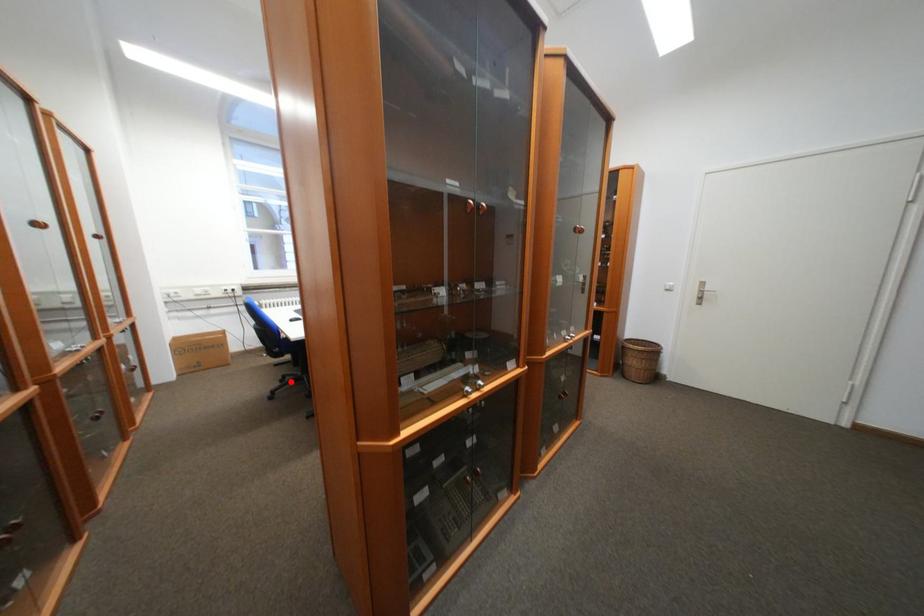
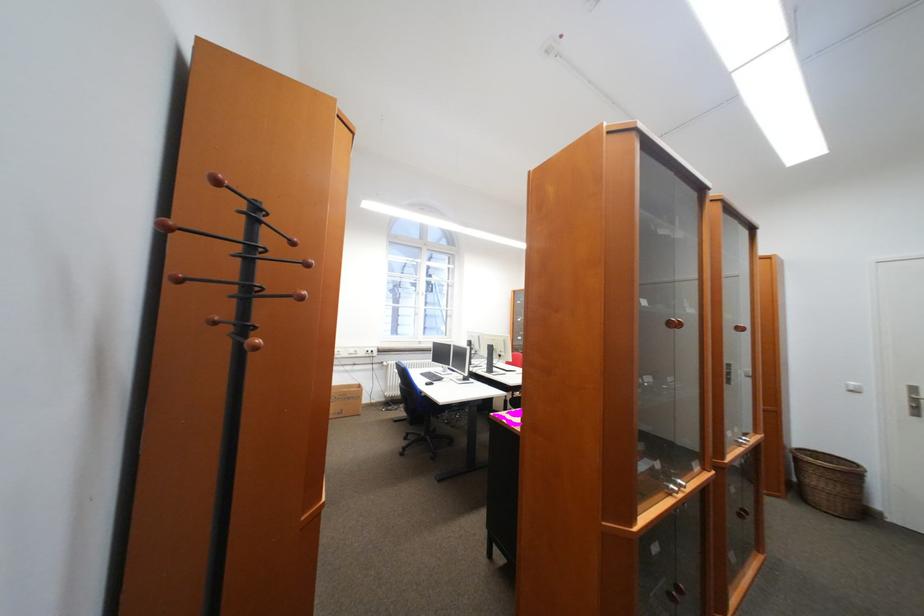
In the second image, find the point that corresponds to the highlighted location in the first image.

(415, 439)